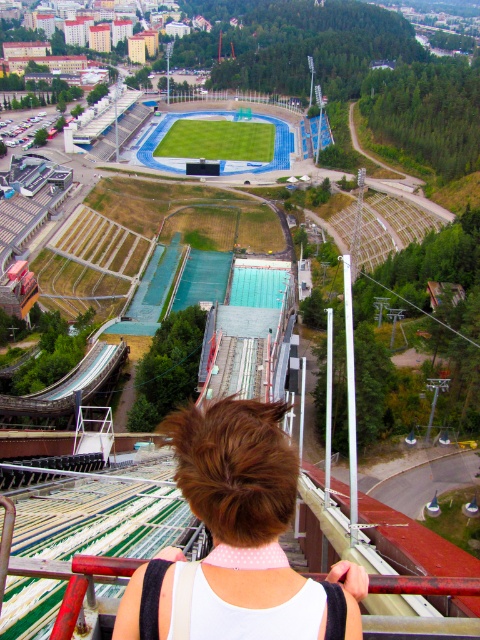
Question: Considering the relative positions of brown hair at center and green grass football field at center in the image provided, where is brown hair at center located with respect to green grass football field at center?

Choices:
 (A) below
 (B) above

Answer: (A)

Question: From the image, what is the correct spatial relationship of brown hair at center in relation to green grass football field at center?

Choices:
 (A) left
 (B) right

Answer: (B)

Question: Among these points, which one is nearest to the camera?

Choices:
 (A) (165, 141)
 (B) (282, 468)

Answer: (B)

Question: Which point appears farthest from the camera in this image?

Choices:
 (A) (176, 152)
 (B) (365, 589)

Answer: (A)

Question: Which point is farther from the camera taking this photo?

Choices:
 (A) (238, 152)
 (B) (356, 573)

Answer: (A)

Question: Can you confirm if brown hair at center is thinner than green grass football field at center?

Choices:
 (A) no
 (B) yes

Answer: (B)